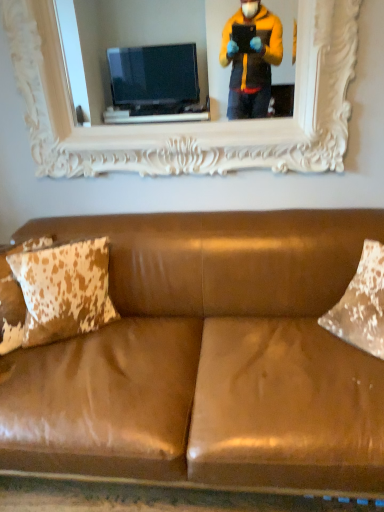
Question: Does brown cowhide pillow at left have a larger size compared to brown leather couch at center?

Choices:
 (A) yes
 (B) no

Answer: (B)

Question: Does brown cowhide pillow at left have a greater width compared to brown leather couch at center?

Choices:
 (A) yes
 (B) no

Answer: (B)

Question: Would you say brown cowhide pillow at left contains brown leather couch at center?

Choices:
 (A) yes
 (B) no

Answer: (B)

Question: Would you say brown cowhide pillow at left is a long distance from brown leather couch at center?

Choices:
 (A) no
 (B) yes

Answer: (A)

Question: Considering the relative positions of brown cowhide pillow at left and brown leather couch at center in the image provided, is brown cowhide pillow at left to the right of brown leather couch at center from the viewer's perspective?

Choices:
 (A) no
 (B) yes

Answer: (A)

Question: From a real-world perspective, is brown cowhide pillow at left positioned above or below brown leather couch at center?

Choices:
 (A) below
 (B) above

Answer: (B)

Question: Is brown cowhide pillow at left in front of or behind brown leather couch at center in the image?

Choices:
 (A) behind
 (B) front

Answer: (A)

Question: Is brown cowhide pillow at left spatially inside brown leather couch at center, or outside of it?

Choices:
 (A) outside
 (B) inside

Answer: (B)

Question: In terms of width, does brown cowhide pillow at left look wider or thinner when compared to brown leather couch at center?

Choices:
 (A) wide
 (B) thin

Answer: (B)

Question: From a real-world perspective, is white carved wood picture frame at upper center above or below brown cowhide pillow at left?

Choices:
 (A) below
 (B) above

Answer: (B)

Question: Relative to brown cowhide pillow at left, is white carved wood picture frame at upper center in front or behind?

Choices:
 (A) behind
 (B) front

Answer: (A)

Question: Is white carved wood picture frame at upper center situated inside brown cowhide pillow at left or outside?

Choices:
 (A) outside
 (B) inside

Answer: (A)

Question: Is point (44, 41) closer or farther from the camera than point (104, 245)?

Choices:
 (A) closer
 (B) farther

Answer: (B)

Question: Considering their positions, is brown leather couch at center located in front of or behind brown cowhide pillow at left?

Choices:
 (A) front
 (B) behind

Answer: (A)

Question: Based on their positions, is brown leather couch at center located to the left or right of brown cowhide pillow at left?

Choices:
 (A) left
 (B) right

Answer: (B)